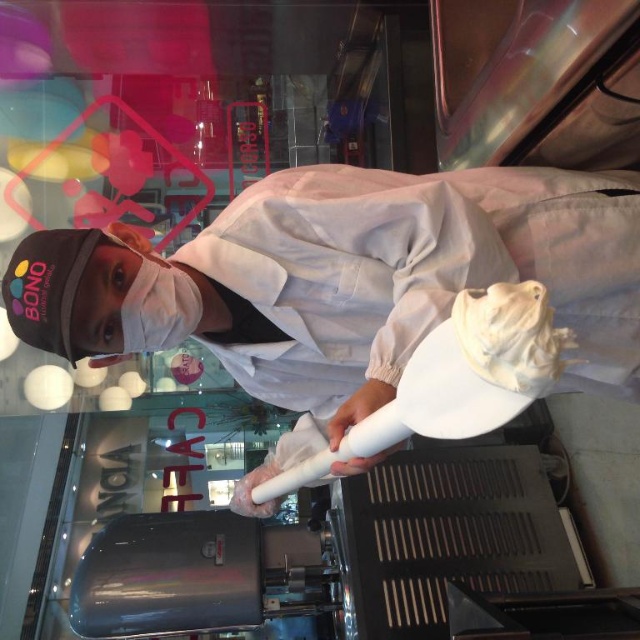
Please describe the exact position of the white matte baseball cap at upper center in the image using coordinates. The answer should include the object label and its coordinates.

The white matte baseball cap at upper center is located at coordinates point (344, 284).

You are a customer in the cafe and want to know which of the two points, point (x=529, y=212) or point (x=458, y=301), is closer to you. Based on the scene, can you determine this?

Point (x=529, y=212) is further to the viewer than point (x=458, y=301), so point (x=458, y=301) is closer to you.

You are a customer in the bakery and want to point out both the white matte baseball cap at upper center and the white fluffy cream at center to the staff. Which one is located to the left of the other?

The white matte baseball cap at upper center is positioned on the left side of white fluffy cream at center.